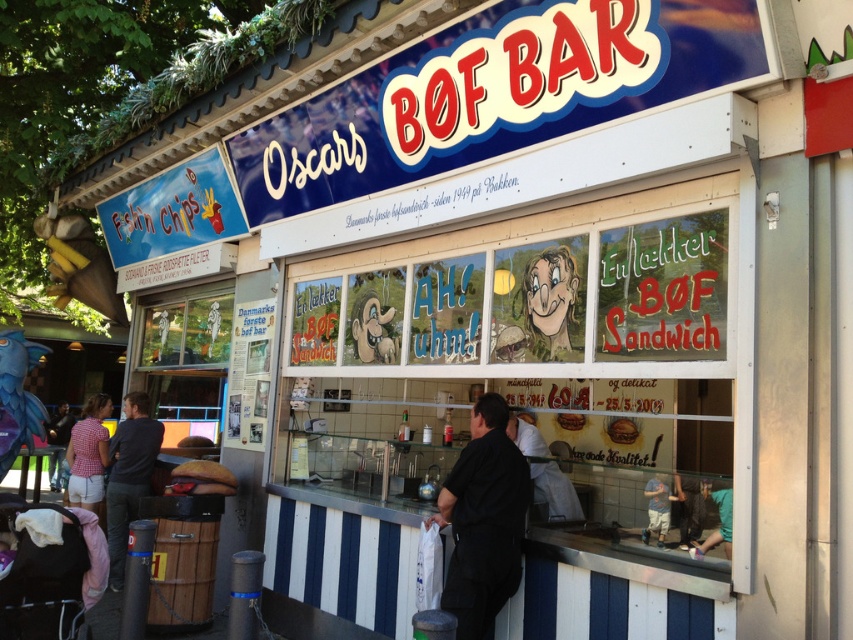
Question: Does black matte shirt at center come behind brown bread at center?

Choices:
 (A) no
 (B) yes

Answer: (A)

Question: Is dark gray shirt at left closer to the viewer compared to plaid shirt at left?

Choices:
 (A) yes
 (B) no

Answer: (A)

Question: Which of the following is the farthest from the observer?

Choices:
 (A) light gray shirt at center
 (B) plaid shirt at lower left

Answer: (B)

Question: Which object is closer to the camera taking this photo?

Choices:
 (A) light gray shirt at center
 (B) golden bread at center
 (C) plaid shirt at lower left
 (D) black matte shirt at center

Answer: (D)

Question: Does black matte shirt at center lie in front of dark gray shirt at left?

Choices:
 (A) no
 (B) yes

Answer: (B)

Question: Which point appears farthest from the camera in this image?

Choices:
 (A) (68, 420)
 (B) (624, 420)
 (C) (485, 442)

Answer: (A)